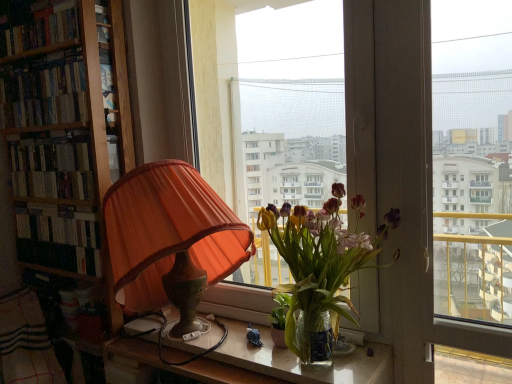
Question: Is hardcover books at left, the 1th book when ordered from bottom to top, completely or partially inside plaid fabric at lower left?

Choices:
 (A) yes
 (B) no

Answer: (B)

Question: From a real-world perspective, is plaid fabric at lower left positioned over hardcover books at left, acting as the 3th book starting from the top, based on gravity?

Choices:
 (A) no
 (B) yes

Answer: (A)

Question: From a real-world perspective, is plaid fabric at lower left positioned under hardcover books at left, acting as the 3th book starting from the top, based on gravity?

Choices:
 (A) no
 (B) yes

Answer: (B)

Question: Is plaid fabric at lower left taller than hardcover books at left, acting as the 3th book starting from the top?

Choices:
 (A) no
 (B) yes

Answer: (B)

Question: From the image's perspective, is plaid fabric at lower left over hardcover books at left, acting as the 3th book starting from the top?

Choices:
 (A) yes
 (B) no

Answer: (B)

Question: Does plaid fabric at lower left appear on the right side of hardcover books at left, the 1th book when ordered from bottom to top?

Choices:
 (A) yes
 (B) no

Answer: (B)

Question: Can you confirm if plaid fabric at lower left is taller than hardcover books at upper left, which ranks as the 3th book in bottom-to-top order?

Choices:
 (A) no
 (B) yes

Answer: (B)

Question: Is hardcover books at upper left, which ranks as the 1th book in top-to-bottom order, located within plaid fabric at lower left?

Choices:
 (A) no
 (B) yes

Answer: (A)

Question: Is plaid fabric at lower left oriented away from hardcover books at upper left, which ranks as the 3th book in bottom-to-top order?

Choices:
 (A) yes
 (B) no

Answer: (B)

Question: Considering the relative sizes of plaid fabric at lower left and hardcover books at upper left, which ranks as the 1th book in top-to-bottom order, in the image provided, is plaid fabric at lower left wider than hardcover books at upper left, which ranks as the 1th book in top-to-bottom order,?

Choices:
 (A) yes
 (B) no

Answer: (A)

Question: From a real-world perspective, does plaid fabric at lower left stand above hardcover books at upper left, which ranks as the 3th book in bottom-to-top order?

Choices:
 (A) yes
 (B) no

Answer: (B)

Question: Can you confirm if plaid fabric at lower left is thinner than hardcover books at upper left, which ranks as the 1th book in top-to-bottom order?

Choices:
 (A) no
 (B) yes

Answer: (A)

Question: Does hardcover books at left, the 1th book when ordered from bottom to top, have a greater width compared to plaid fabric at lower left?

Choices:
 (A) yes
 (B) no

Answer: (B)